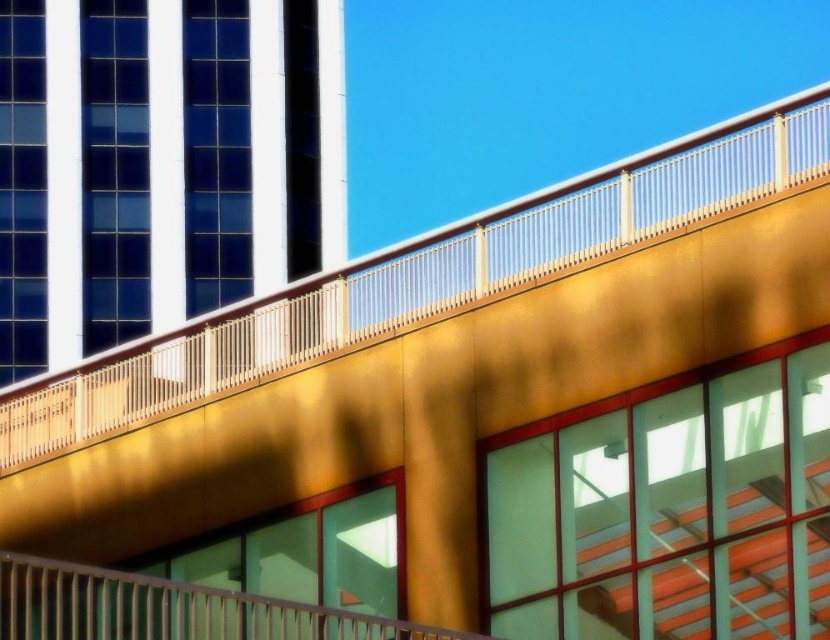
Does gold metallic balcony at upper center appear on the right side of metallic silver railing at center?

No, gold metallic balcony at upper center is not to the right of metallic silver railing at center.

Can you confirm if gold metallic balcony at upper center is positioned to the left of metallic silver railing at center?

Indeed, gold metallic balcony at upper center is positioned on the left side of metallic silver railing at center.

This screenshot has width=830, height=640. What do you see at coordinates (423, 276) in the screenshot? I see `gold metallic balcony at upper center` at bounding box center [423, 276].

What are the coordinates of `gold metallic balcony at upper center` in the screenshot? It's located at tap(423, 276).